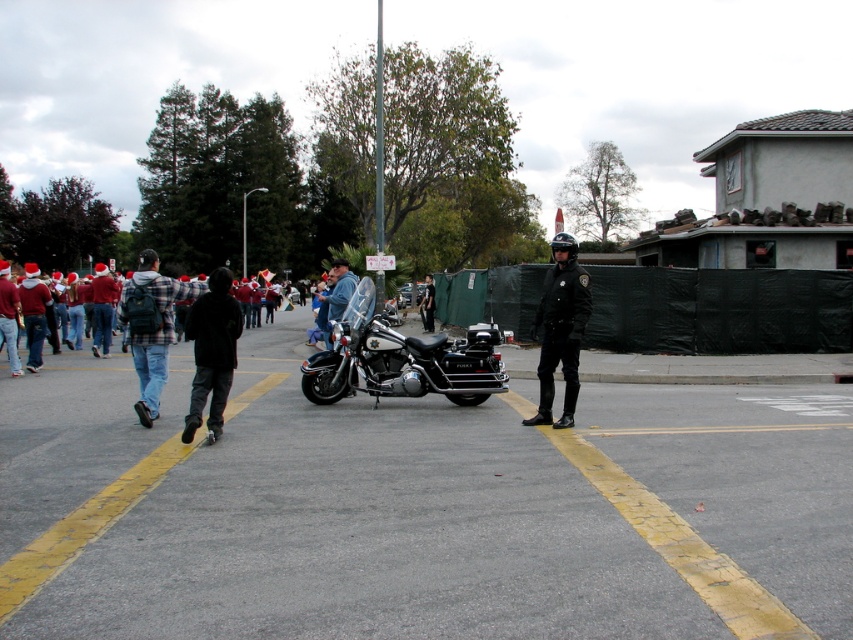
Question: Can you confirm if black uniformed officer at center is positioned below denim jacket at center?

Choices:
 (A) no
 (B) yes

Answer: (B)

Question: Which point is farther to the camera?

Choices:
 (A) denim jacket at center
 (B) black uniformed officer at center
 (C) smooth asphalt parking lot at center
 (D) shiny chrome motorcycle at center

Answer: (A)

Question: Is black uniformed officer at center to the left of denim jacket at center from the viewer's perspective?

Choices:
 (A) yes
 (B) no

Answer: (B)

Question: Which object is farther from the camera taking this photo?

Choices:
 (A) smooth asphalt parking lot at center
 (B) denim jacket at center

Answer: (B)

Question: Observing the image, what is the correct spatial positioning of smooth asphalt parking lot at center in reference to shiny chrome motorcycle at center?

Choices:
 (A) below
 (B) above

Answer: (A)

Question: Which object is positioned farthest from the denim jacket at center?

Choices:
 (A) shiny chrome motorcycle at center
 (B) smooth asphalt parking lot at center
 (C) black uniformed officer at center

Answer: (B)